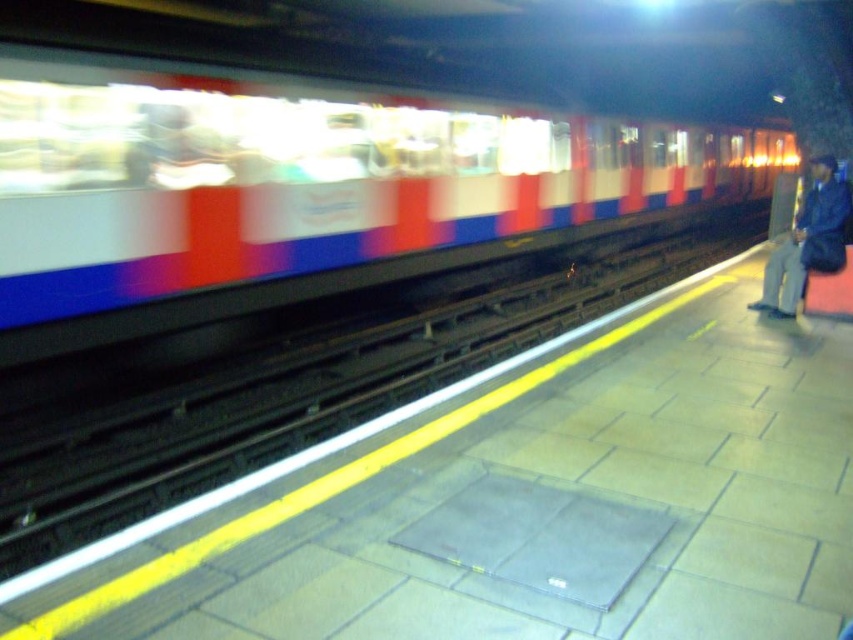
Question: In this image, where is white glossy train at center located relative to blue denim jacket at right?

Choices:
 (A) right
 (B) left

Answer: (B)

Question: Which of the following is the closest to the observer?

Choices:
 (A) blue denim jacket at right
 (B) white glossy train at center

Answer: (B)

Question: Where is white glossy train at center located in relation to blue denim jacket at right in the image?

Choices:
 (A) above
 (B) below

Answer: (A)

Question: Which point is closer to the camera taking this photo?

Choices:
 (A) (26, 307)
 (B) (816, 252)

Answer: (A)

Question: Is the position of white glossy train at center more distant than that of blue denim jacket at right?

Choices:
 (A) no
 (B) yes

Answer: (A)